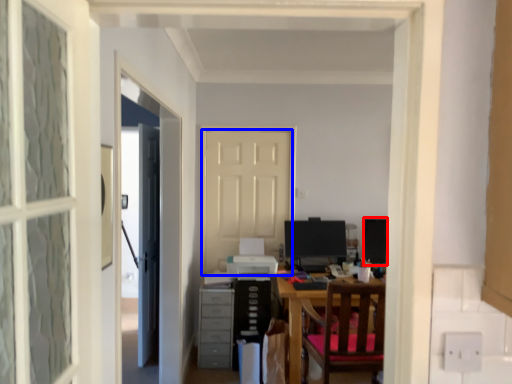
Question: Among these objects, which one is nearest to the camera, computer monitor (highlighted by a red box) or door (highlighted by a blue box)?

Choices:
 (A) computer monitor
 (B) door

Answer: (A)